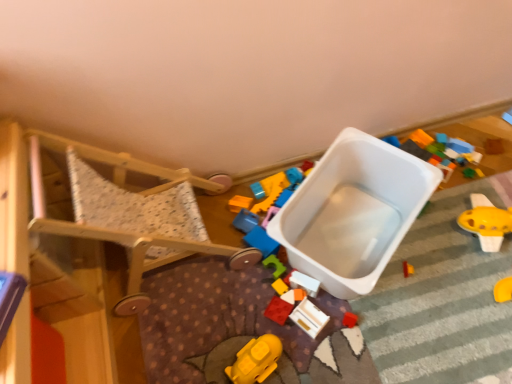
In order to click on free area in between rubberized red block at center, which appears as the fifth toy when viewed from the right, and yellow plastic toy at right, which is counted as the first toy, starting from the right in this screenshot , I will do `click(404, 266)`.